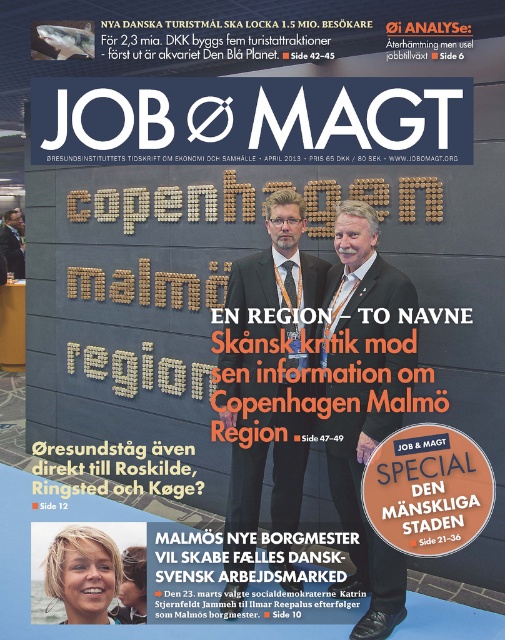
Question: Which point is closer to the camera?

Choices:
 (A) matte black suit at center
 (B) white textured suit at center
 (C) blonde hair at upper center
 (D) dark suit at center

Answer: (C)

Question: Which of the following is the farthest from the observer?

Choices:
 (A) (372, 614)
 (B) (20, 230)
 (C) (239, 385)

Answer: (B)

Question: Can you confirm if white textured suit at center is positioned below blonde hair at upper center?

Choices:
 (A) no
 (B) yes

Answer: (A)

Question: Observing the image, what is the correct spatial positioning of dark suit at center in reference to white textured suit at center?

Choices:
 (A) left
 (B) right

Answer: (A)

Question: Which point is farther to the camera?

Choices:
 (A) (335, 280)
 (B) (20, 244)
 (C) (113, 561)

Answer: (B)

Question: Is blonde hair at upper center smaller than matte black suit at center?

Choices:
 (A) no
 (B) yes

Answer: (B)